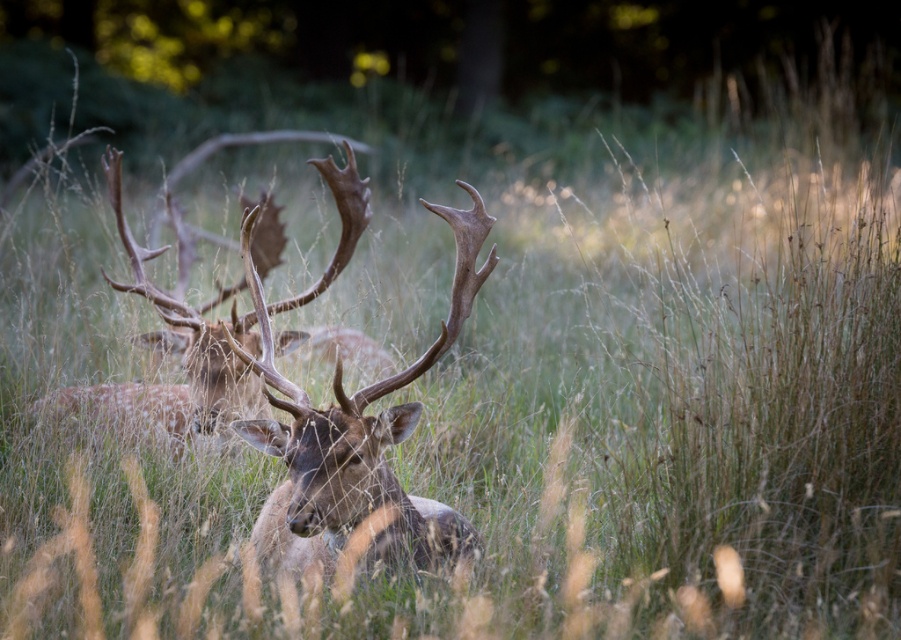
In the serene natural scene with deer in the grassy field, there are two types of antlers visible at the center. The first is labeled as brown fur antlers at center, and the second is brown velvet antlers at center. From an observer standing in front of the deer, which antlers appear closer to you?

The brown fur antlers at center appear closer to the observer because they are positioned under the brown velvet antlers at center, indicating they are in front.

In the scene, there are two types of antlers visible in the center of the image. Which one is smaller between the brown fur antlers at center and the brown velvet antlers at center?

The brown fur antlers at center is smaller than brown velvet antlers at center.

In the serene natural scene with deer in a grassy field, you notice two sets of antlers at the center. Which of the two, the brown fur antlers at center or the brown velvet antlers at center, is shorter?

The brown fur antlers at center is shorter than the brown velvet antlers at center.